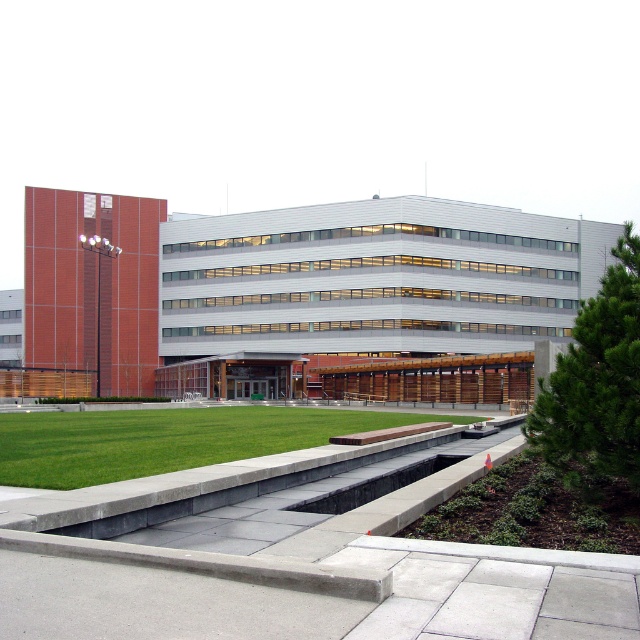
You are standing at the point indicated by point (294,282) in the image. What building are you facing? Please answer concisely.

The point (294,282) indicates you are facing the matte brick building at left.

You are standing in front of the modern building complex. You see two points marked on the building facade. The first point is at coordinate point (x=220, y=260) and the second is at point (x=136, y=444). Which point is closer to you?

Point (x=220, y=260) is further to the camera than point (x=136, y=444), so the point closer to you is point (x=136, y=444).

You are standing on the gray concrete pavement at lower center and want to walk towards the matte brick building at left. In which direction should you head?

You should head to the right side since the matte brick building at left is positioned on the right side of gray concrete pavement at lower center.